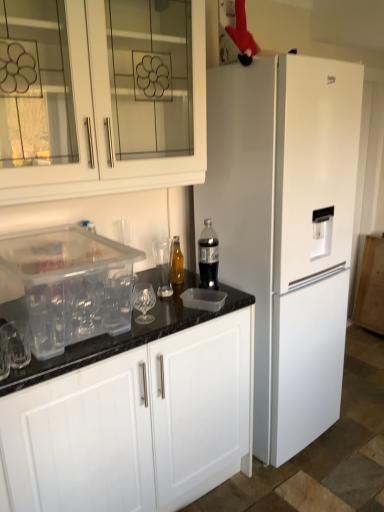
Locate an element on the screen. This screenshot has width=384, height=512. free location in front of translucent plastic bottle at center, positioned as the 1th bottle in front-to-back order is located at coordinates (192, 313).